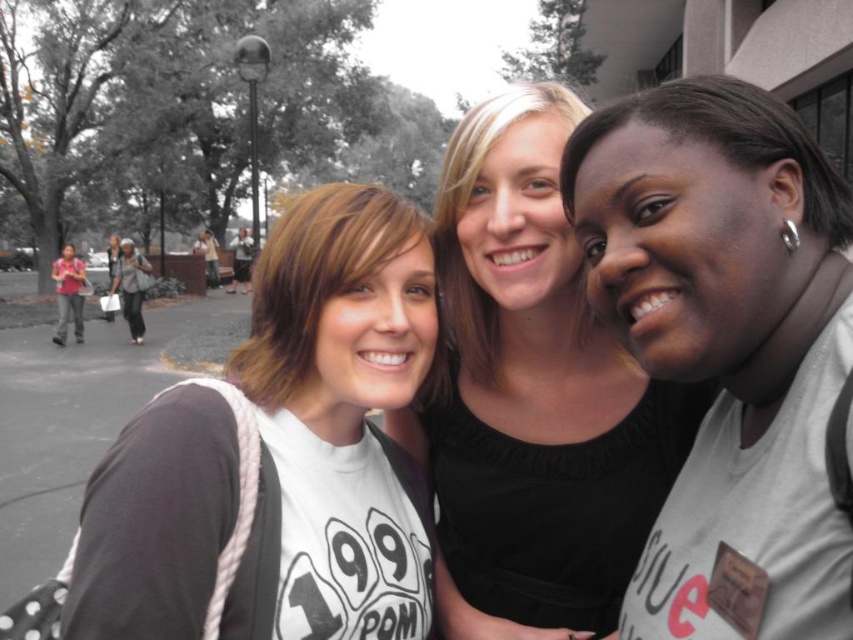
Can you confirm if white matte t-shirt at right is positioned below smooth black shirt at center?

Incorrect, white matte t-shirt at right is not positioned below smooth black shirt at center.

What are the coordinates of `white matte t-shirt at right` in the screenshot? It's located at (726, 336).

Is point (624, 276) more distant than point (460, 593)?

No.

Locate an element on the screen. The width and height of the screenshot is (853, 640). white matte t-shirt at right is located at coordinates (726, 336).

Is smooth black shirt at center below matte white t-shirt at center?

Actually, smooth black shirt at center is above matte white t-shirt at center.

The image size is (853, 640). What do you see at coordinates (532, 394) in the screenshot? I see `smooth black shirt at center` at bounding box center [532, 394].

What do you see at coordinates (532, 394) in the screenshot? I see `smooth black shirt at center` at bounding box center [532, 394].

Find the location of a particular element. smooth black shirt at center is located at coordinates (532, 394).

Does matte white t-shirt at center have a greater height compared to light gray fabric jacket at left?

In fact, matte white t-shirt at center may be shorter than light gray fabric jacket at left.

Does matte white t-shirt at center come behind light gray fabric jacket at left?

No, it is not.

This screenshot has width=853, height=640. Describe the element at coordinates (344, 328) in the screenshot. I see `matte white t-shirt at center` at that location.

What are the coordinates of `matte white t-shirt at center` in the screenshot? It's located at (344, 328).